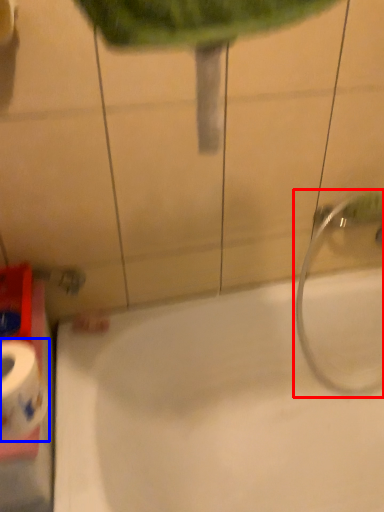
Question: Which point is further to the camera, plumbing fixture (highlighted by a red box) or toilet paper (highlighted by a blue box)?

Choices:
 (A) plumbing fixture
 (B) toilet paper

Answer: (A)